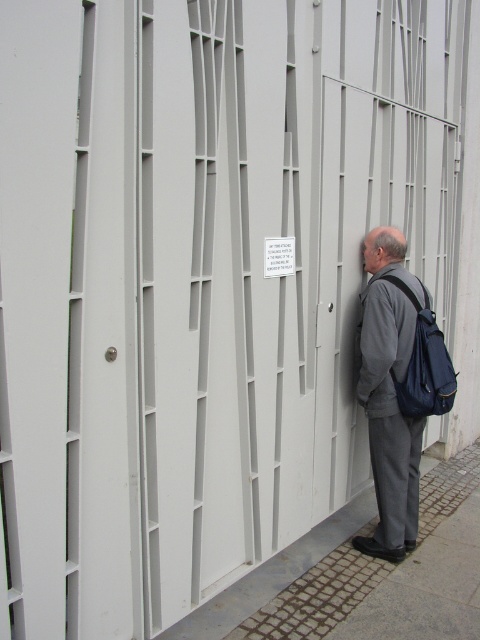
You are standing on the gray cobblestone pavement at lower right and want to place the gray fabric backpack at right on the ground. Can you determine if the backpack will fit on the pavement?

The gray cobblestone pavement at lower right has a larger size compared to gray fabric backpack at right, so the backpack will fit on the pavement.

You are standing on the gray cobblestone pavement at lower right and want to place a small box on the gray fabric backpack at right. Can you reach the backpack from your current position without moving?

The gray cobblestone pavement at lower right is not as tall as the gray fabric backpack at right, so you can reach the backpack from the pavement without needing to move.